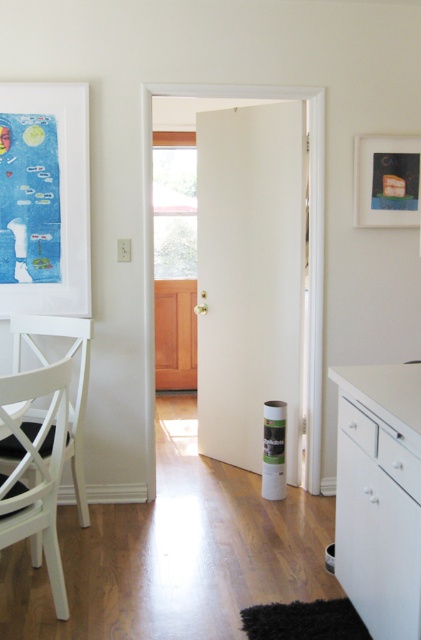
Is white glossy cabinet at lower right positioned behind matte white picture frame at upper left?

No, it is not.

In the scene shown: Who is higher up, white glossy cabinet at lower right or matte white picture frame at upper left?

Positioned higher is matte white picture frame at upper left.

I want to click on white glossy cabinet at lower right, so pos(380,497).

Does matte white picture frame at upper left appear over white matte chair at left?

Correct, matte white picture frame at upper left is located above white matte chair at left.

Locate an element on the screen. matte white picture frame at upper left is located at coordinates (44, 198).

Between point (53, 113) and point (356, 140), which one is positioned in front?

Positioned in front is point (53, 113).

Locate an element on the screen. The image size is (421, 640). matte white picture frame at upper left is located at coordinates (44, 198).